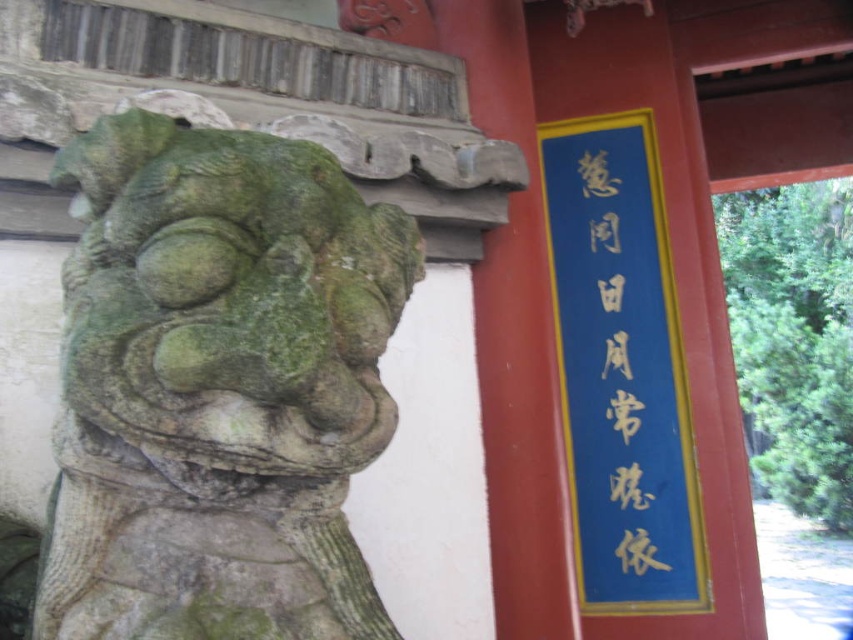
Question: Can you confirm if green stone lion at left is bigger than blue paper sign at upper right?

Choices:
 (A) yes
 (B) no

Answer: (A)

Question: Does green stone lion at left have a greater width compared to blue paper sign at upper right?

Choices:
 (A) yes
 (B) no

Answer: (A)

Question: Among these objects, which one is nearest to the camera?

Choices:
 (A) blue paper sign at upper right
 (B) green stone lion at left

Answer: (B)

Question: Can you confirm if green stone lion at left is positioned above blue paper sign at upper right?

Choices:
 (A) no
 (B) yes

Answer: (A)